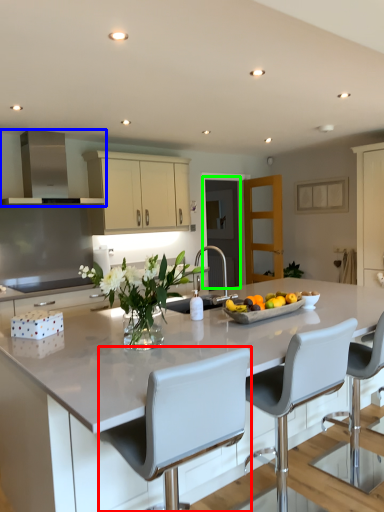
Question: Which is nearer to the chair (highlighted by a red box)? exhaust hood (highlighted by a blue box) or glass door (highlighted by a green box).

Choices:
 (A) exhaust hood
 (B) glass door

Answer: (A)